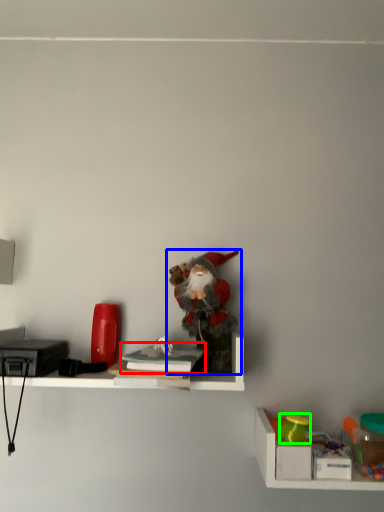
Question: Based on their relative distances, which object is farther from book (highlighted by a red box)? Choose from toy (highlighted by a blue box) and toy (highlighted by a green box).

Choices:
 (A) toy
 (B) toy

Answer: (B)